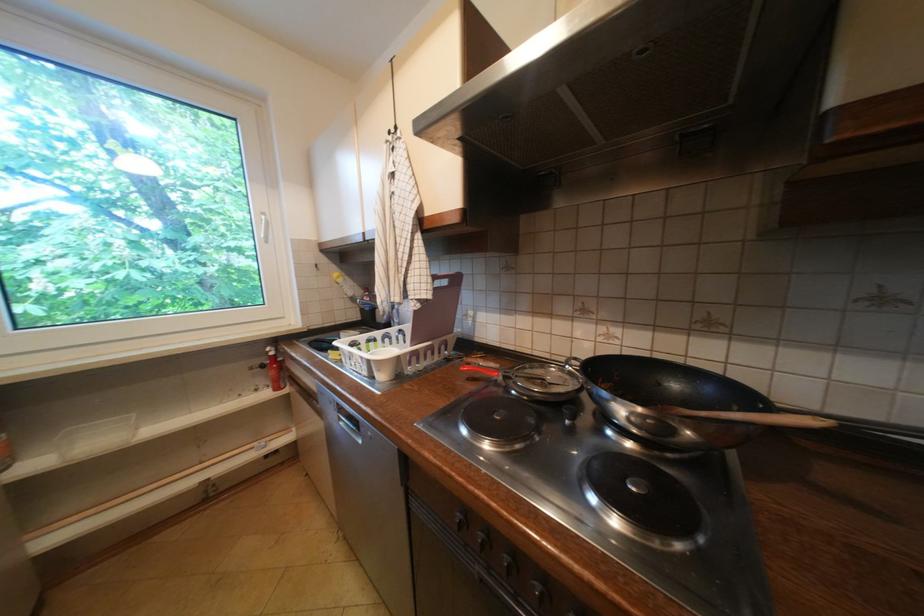
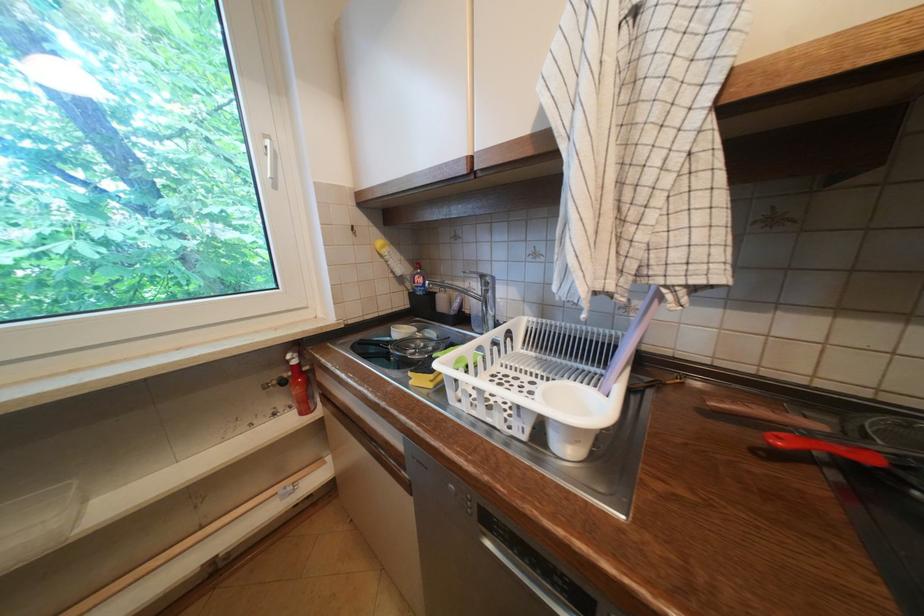
Find the pixel in the second image that matches point (271, 221) in the first image.

(274, 148)